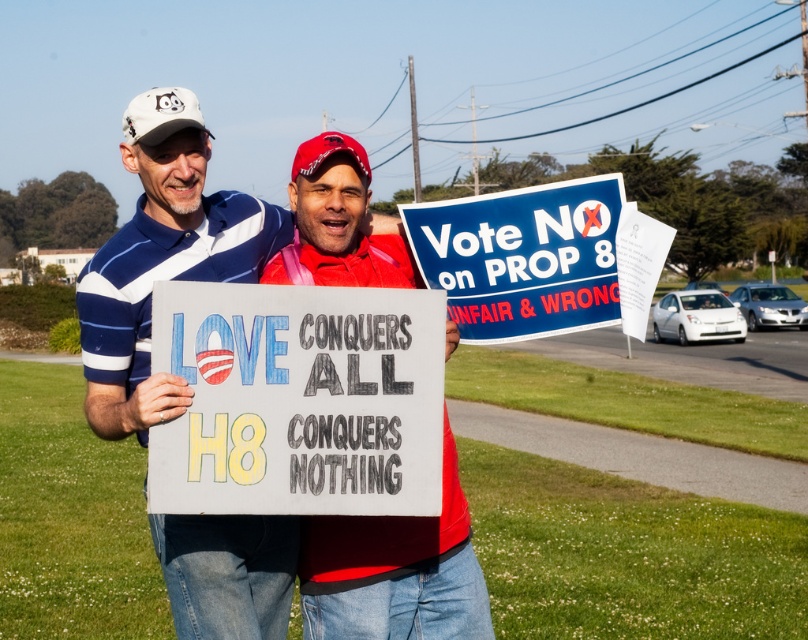
You are a pedestrian walking on the sidewalk and see two signs held by protesters. The white plastic sign at center and the blue paper sign at upper center. Which sign is positioned to the left of the other?

The white plastic sign at center is to the left of the blue paper sign at upper center.